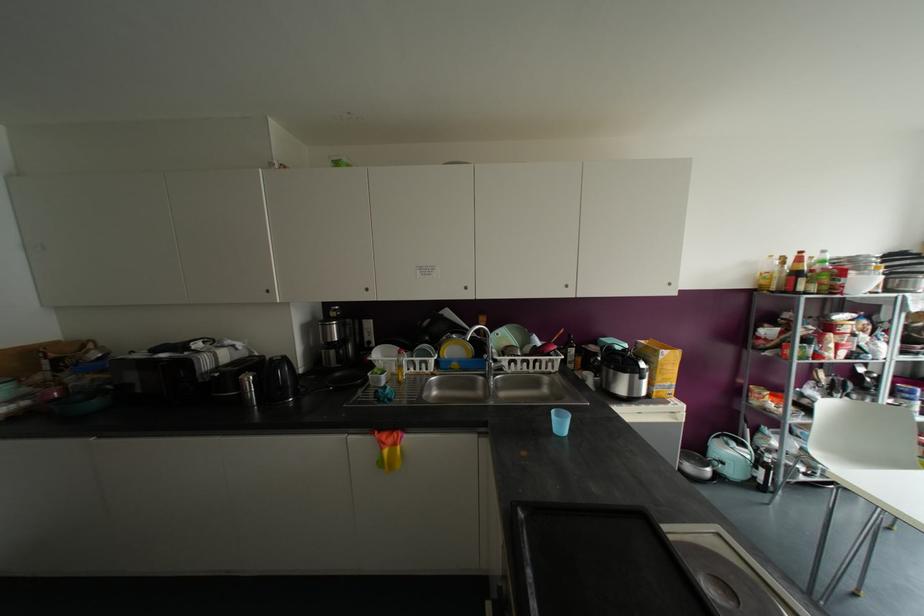
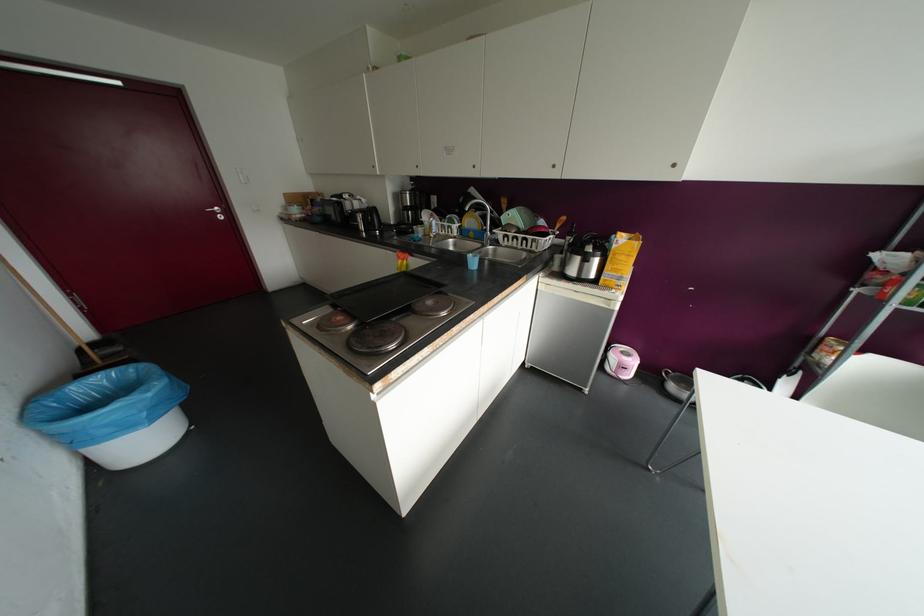
Find the pixel in the second image that matches [465,286] in the first image.

(473, 166)